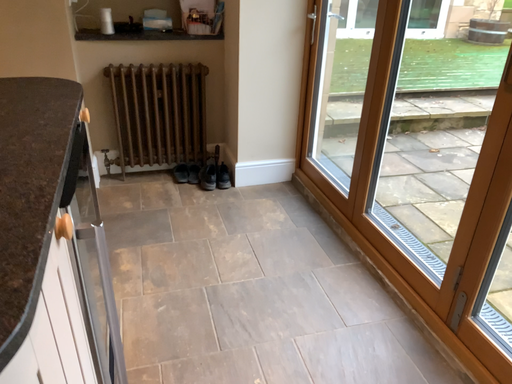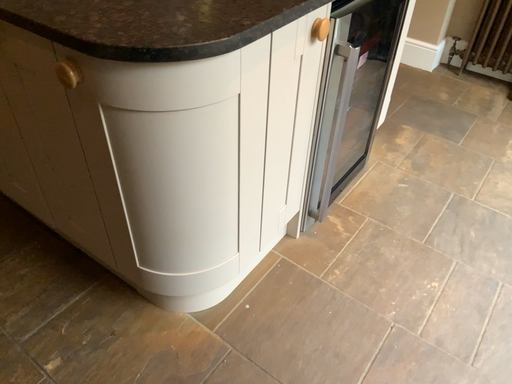
Question: How did the camera likely rotate when shooting the video?

Choices:
 (A) rotated left
 (B) rotated right

Answer: (A)